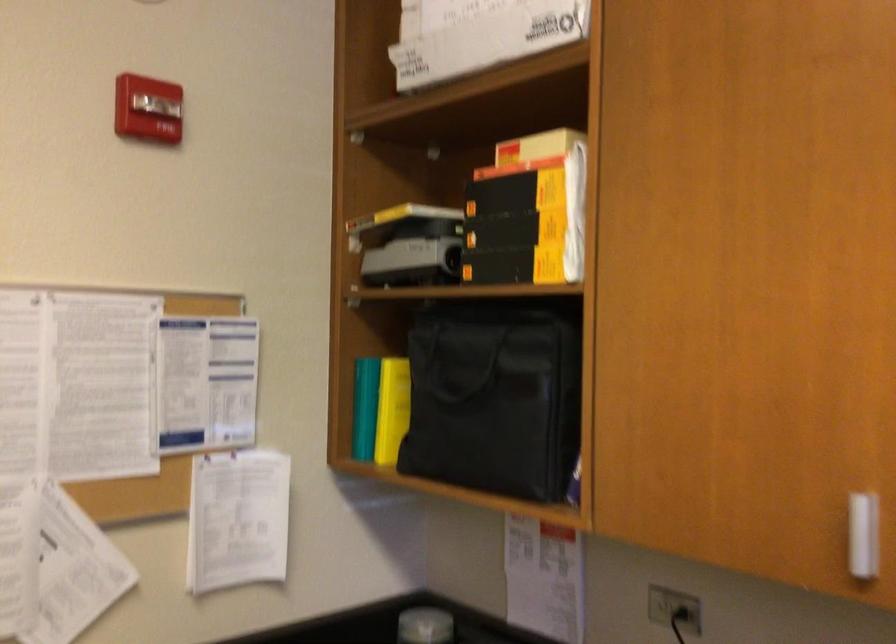
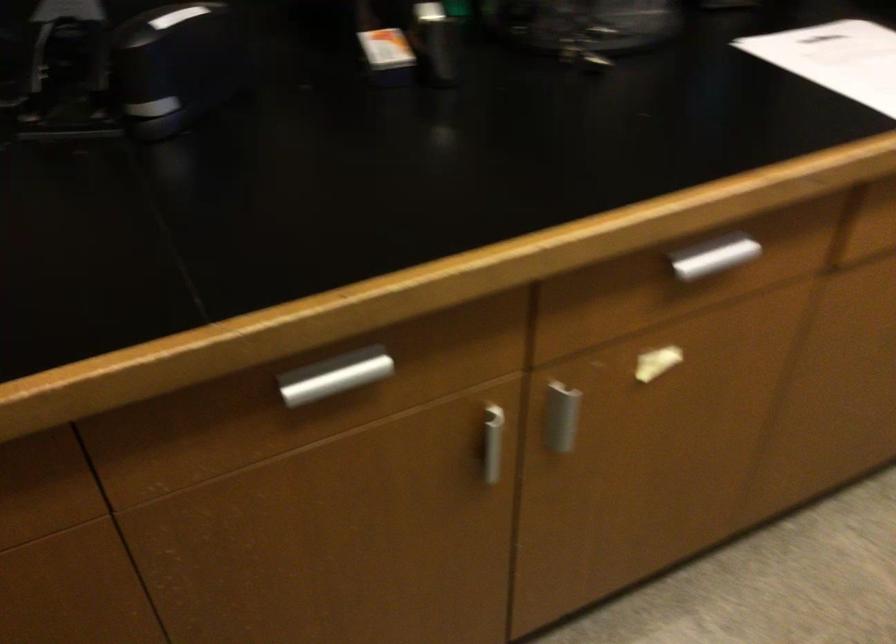
The first image is from the beginning of the video and the second image is from the end. How did the camera likely rotate when shooting the video?

The camera rotated toward right-down.